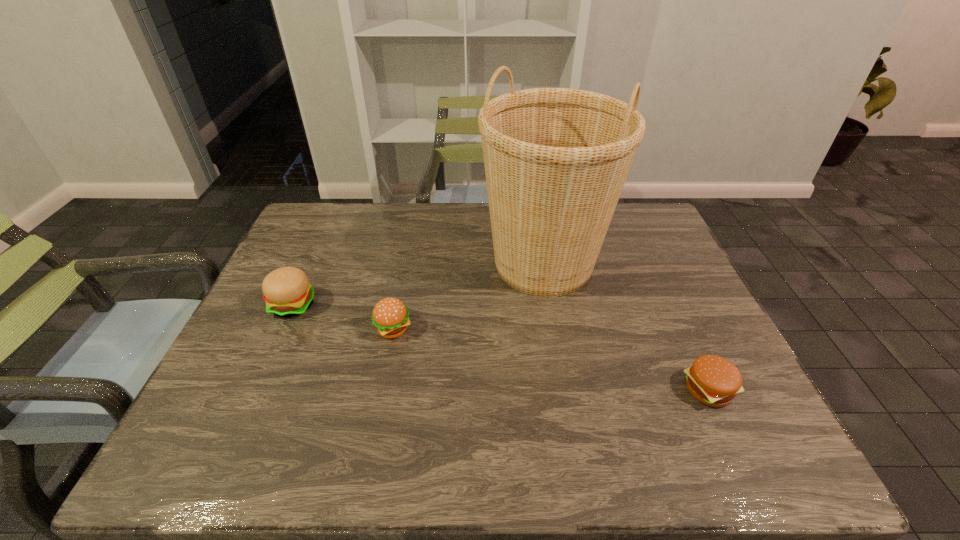
Identify the location of unoccupied position between the second hamburger from right to left and the rightmost object. (551, 359).

At what (x,y) coordinates should I click in order to perform the action: click on free space that is in between the leftmost hamburger and the rightmost hamburger. Please return your answer as a coordinate pair (x, y). Image resolution: width=960 pixels, height=540 pixels. Looking at the image, I should click on (501, 347).

Find the location of a particular element. The width and height of the screenshot is (960, 540). vacant space in between the shortest hamburger and the second tallest hamburger is located at coordinates (551, 359).

Locate an element on the screen. empty space that is in between the nearest object and the second hamburger from right to left is located at coordinates click(x=551, y=359).

Identify the location of vacant space that's between the tallest object and the second hamburger from left to right. (468, 296).

Identify the location of blank region between the tallest object and the leftmost hamburger. The height and width of the screenshot is (540, 960). (419, 285).

The image size is (960, 540). I want to click on blank region between the second shortest object and the leftmost object, so (x=344, y=317).

Find the location of `free area in between the leftmost object and the second hamburger from right to left`. free area in between the leftmost object and the second hamburger from right to left is located at coordinates (344, 317).

In order to click on vacant space in between the shortest object and the leftmost hamburger in this screenshot , I will do `click(501, 347)`.

The image size is (960, 540). In order to click on free spot between the shortest hamburger and the basket in this screenshot , I will do (626, 327).